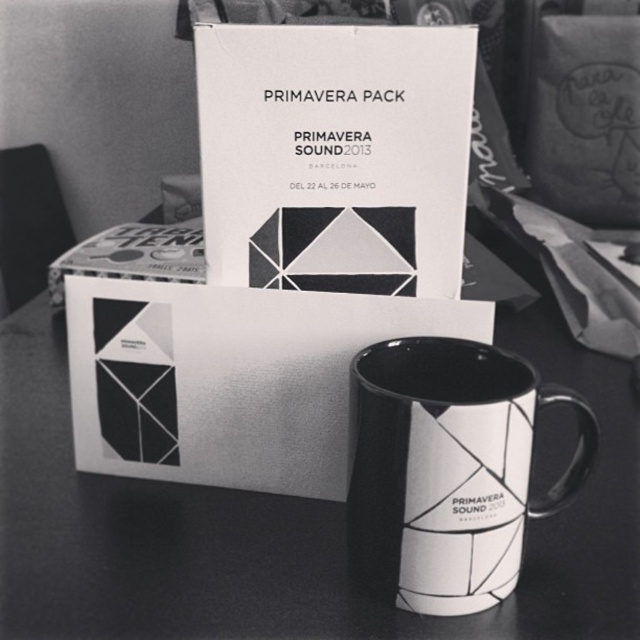
Question: Does white glossy mug at center come behind white matte cardboard box at center?

Choices:
 (A) yes
 (B) no

Answer: (B)

Question: Does white matte cardboard box at center come behind white glossy mug at lower center?

Choices:
 (A) no
 (B) yes

Answer: (B)

Question: Which object is closer to the camera taking this photo?

Choices:
 (A) white glossy mug at lower center
 (B) white matte cardboard box at center
 (C) white glossy mug at center

Answer: (A)

Question: Which is farther from the white glossy mug at lower center?

Choices:
 (A) white matte cardboard box at center
 (B) white glossy mug at center

Answer: (B)

Question: Which object is closer to the camera taking this photo?

Choices:
 (A) white matte cardboard box at center
 (B) white glossy mug at lower center
 (C) white glossy mug at center

Answer: (B)

Question: Does white glossy mug at center have a smaller size compared to white matte cardboard box at center?

Choices:
 (A) yes
 (B) no

Answer: (B)